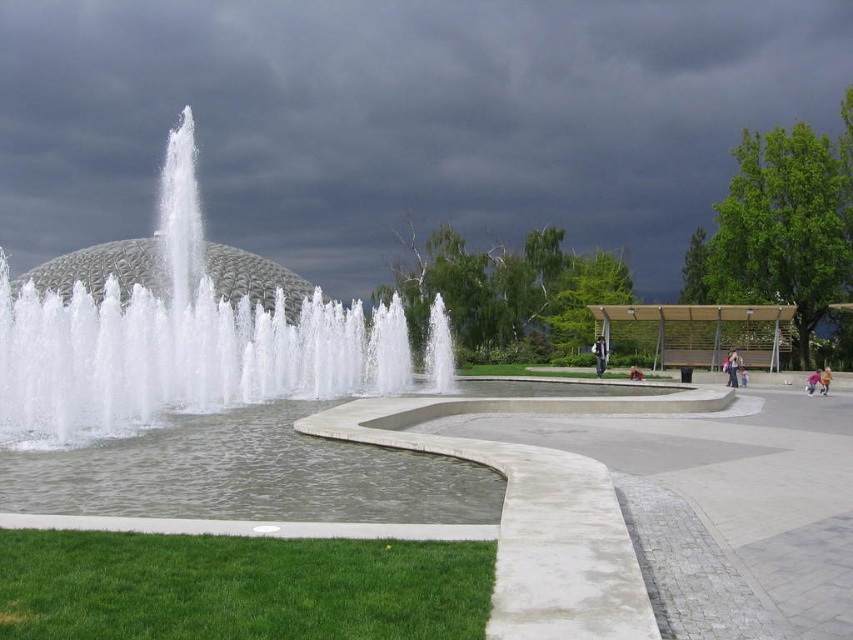
You are standing at the edge of the fountain and want to sit down. Which object should you approach first to reach the light brown wooden bench at center right and the pink fabric person at lower right?

You should approach the pink fabric person at lower right first because the light brown wooden bench at center right is to the left of the pink fabric person at lower right, meaning the bench is further away from your starting position at the fountain.

You are standing at the fountain and want to take a photo of the dark gray cloud at upper center. If your camera has a zoom range of 100 meters, will you be able to capture the cloud in the photo?

The dark gray cloud at upper center is 98.31 meters away from the camera. Since the camera can zoom up to 100 meters, you can capture the cloud in the photo as it is within the zoom range.